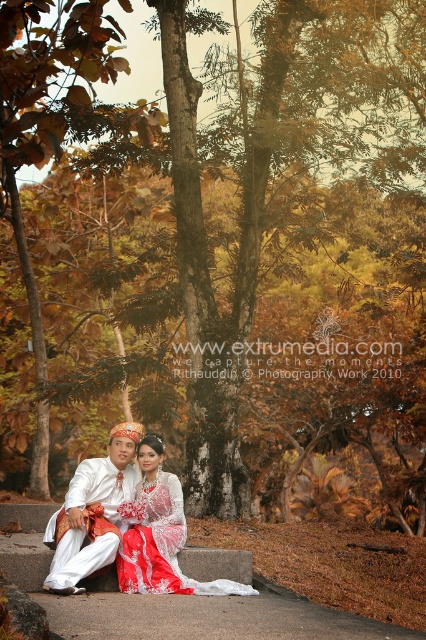
You are a photographer trying to capture the couple in the scene. Since both the white satin suit at center and the white lace dress at center are in the same area, which one should you focus on to ensure the subject is closer to the camera?

The white satin suit at center is in front of the white lace dress at center, so focusing on the white satin suit at center will ensure the subject is closer to the camera.

You are a photographer arranging a couple for a photo shoot. The scene has a couple in a white satin suit at center and a white lace dress at center. You need to ensure that both subjects are visible in the final shot. Based on their positions, which subject is more likely to be in the foreground?

The white satin suit at center is positioned over the white lace dress at center, meaning it is closer to the camera and thus in the foreground.